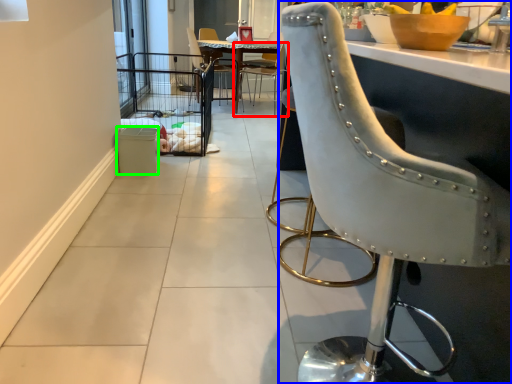
Question: Which object is positioned closest to chair (highlighted by a red box)? Select from chair (highlighted by a blue box) and trash bin/can (highlighted by a green box).

Choices:
 (A) chair
 (B) trash bin/can

Answer: (B)